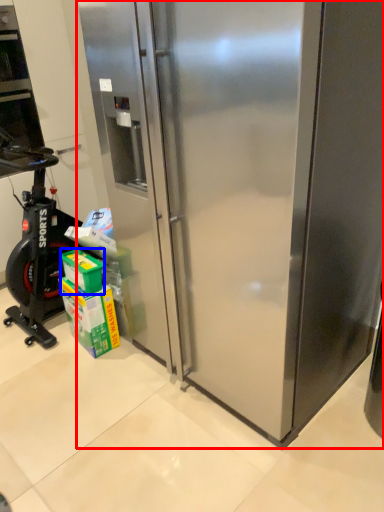
Question: Among these objects, which one is farthest to the camera, refrigerator (highlighted by a red box) or box (highlighted by a blue box)?

Choices:
 (A) refrigerator
 (B) box

Answer: (B)